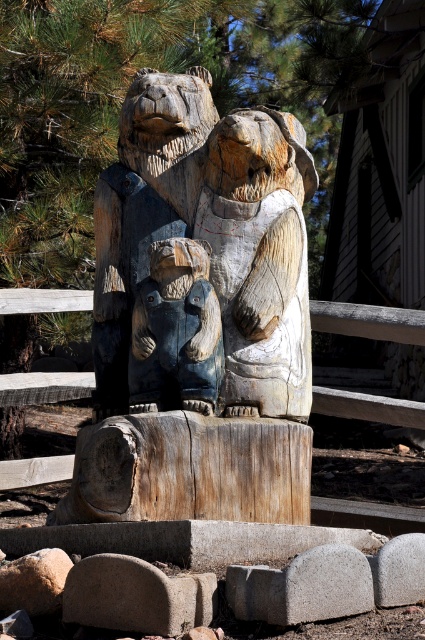
Which is more to the left, carved wood bear family at center or blue painted wood bear at center?

blue painted wood bear at center is more to the left.

Does carved wood bear family at center have a smaller size compared to blue painted wood bear at center?

No, carved wood bear family at center is not smaller than blue painted wood bear at center.

This screenshot has height=640, width=425. In order to click on carved wood bear family at center in this screenshot , I will do `click(203, 257)`.

Locate an element on the screen. This screenshot has height=640, width=425. carved wood bear family at center is located at coordinates (203, 257).